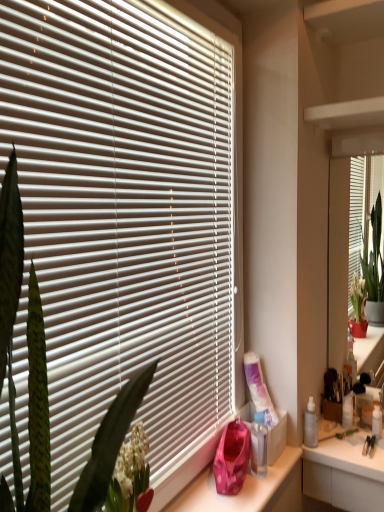
You are a GUI agent. You are given a task and a screenshot of the screen. Output one action in this format:
    pyautogui.click(x=<x>, y=<y>)
    Task: Click on the free space to the left of white plastic bottle at right, the second toiletry in the front-to-back sequence
    The height and width of the screenshot is (512, 384).
    Given the screenshot: What is the action you would take?
    pyautogui.click(x=323, y=432)